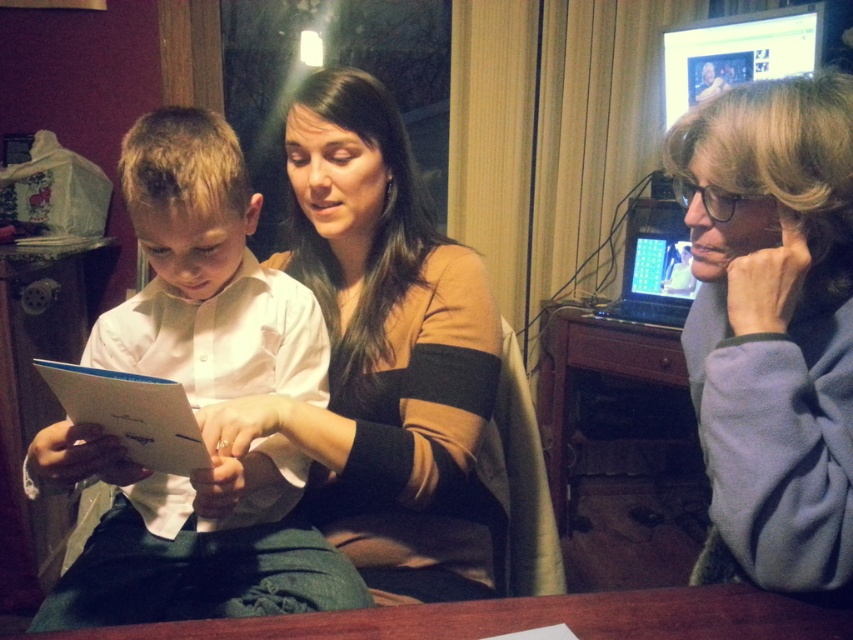
Where is `gray fleece jacket at right`? Image resolution: width=853 pixels, height=640 pixels. gray fleece jacket at right is located at coordinates (773, 323).

Does gray fleece jacket at right have a lesser width compared to wooden table at right?

Indeed, gray fleece jacket at right has a lesser width compared to wooden table at right.

This screenshot has height=640, width=853. What do you see at coordinates (773, 323) in the screenshot?
I see `gray fleece jacket at right` at bounding box center [773, 323].

At what (x,y) coordinates should I click in order to perform the action: click on gray fleece jacket at right. Please return your answer as a coordinate pair (x, y). Looking at the image, I should click on (773, 323).

From the picture: Does white smooth shirt at center have a greater width compared to shiny plastic monitor at upper right?

Yes.

Does white smooth shirt at center have a lesser height compared to shiny plastic monitor at upper right?

Incorrect, white smooth shirt at center's height does not fall short of shiny plastic monitor at upper right's.

You are a GUI agent. You are given a task and a screenshot of the screen. Output one action in this format:
    pyautogui.click(x=<x>, y=<y>)
    Task: Click on the white smooth shirt at center
    The image size is (853, 640).
    Given the screenshot: What is the action you would take?
    pyautogui.click(x=189, y=538)

In order to click on white smooth shirt at center in this screenshot , I will do `click(189, 538)`.

Is point (218, 474) behind point (779, 582)?

Yes, it is.

From the picture: Who is taller, white smooth shirt at center or gray fleece jacket at right?

With more height is white smooth shirt at center.

Who is more forward, (135, 134) or (728, 308)?

Point (728, 308)

What are the coordinates of `white smooth shirt at center` in the screenshot? It's located at (189, 538).